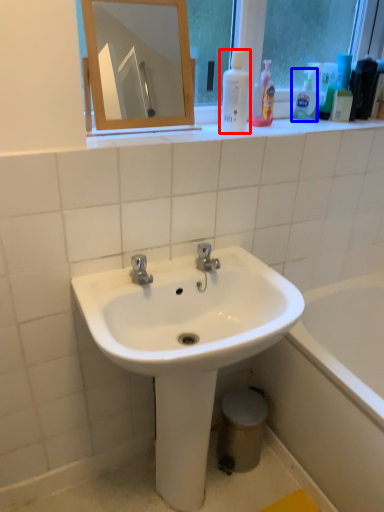
Question: Which object appears farthest to the camera in this image, cleaning product (highlighted by a red box) or cleaning product (highlighted by a blue box)?

Choices:
 (A) cleaning product
 (B) cleaning product

Answer: (B)